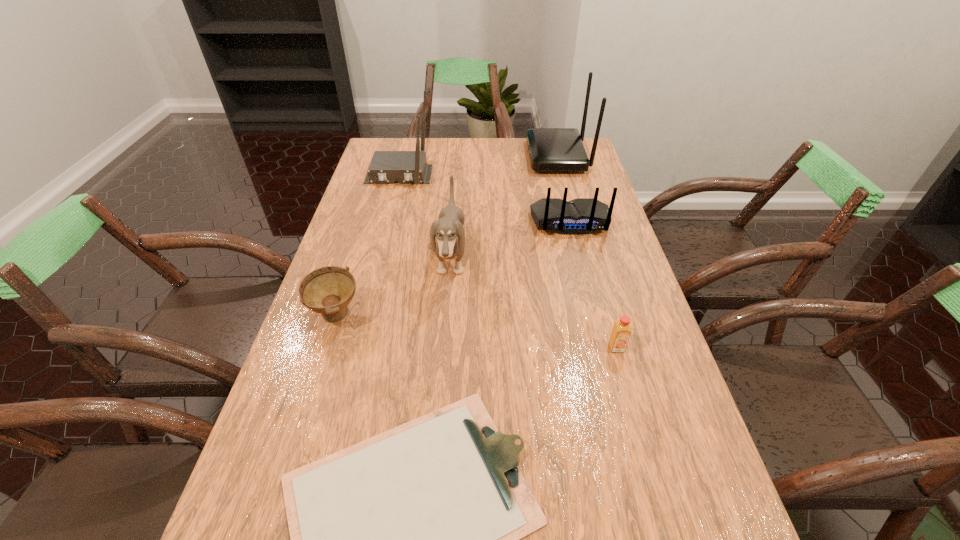
I want to click on vacant area that lies between the shortest router and the leftmost router, so click(x=485, y=198).

At what (x,y) coordinates should I click in order to perform the action: click on vacant region between the soup bowl and the puppy. Please return your answer as a coordinate pair (x, y). Looking at the image, I should click on (394, 286).

Where is `vacant area between the leftmost router and the nearest router`? vacant area between the leftmost router and the nearest router is located at coordinates (485, 198).

This screenshot has height=540, width=960. I want to click on free space between the nearest router and the leftmost router, so [485, 198].

The height and width of the screenshot is (540, 960). In order to click on unoccupied position between the puppy and the leftmost router in this screenshot , I will do `click(425, 215)`.

Point out which object is positioned as the sixth nearest to the shortest object. Please provide its 2D coordinates. Your answer should be formatted as a tuple, i.e. [(x, y)], where the tuple contains the x and y coordinates of a point satisfying the conditions above.

[(550, 149)]

This screenshot has height=540, width=960. Identify the location of the closest object to the puppy. (328, 290).

The width and height of the screenshot is (960, 540). Identify the location of router that stands as the closest to the orange juice. (580, 216).

Identify which router is the nearest to the sixth farthest object. Please provide its 2D coordinates. Your answer should be formatted as a tuple, i.e. [(x, y)], where the tuple contains the x and y coordinates of a point satisfying the conditions above.

[(580, 216)]